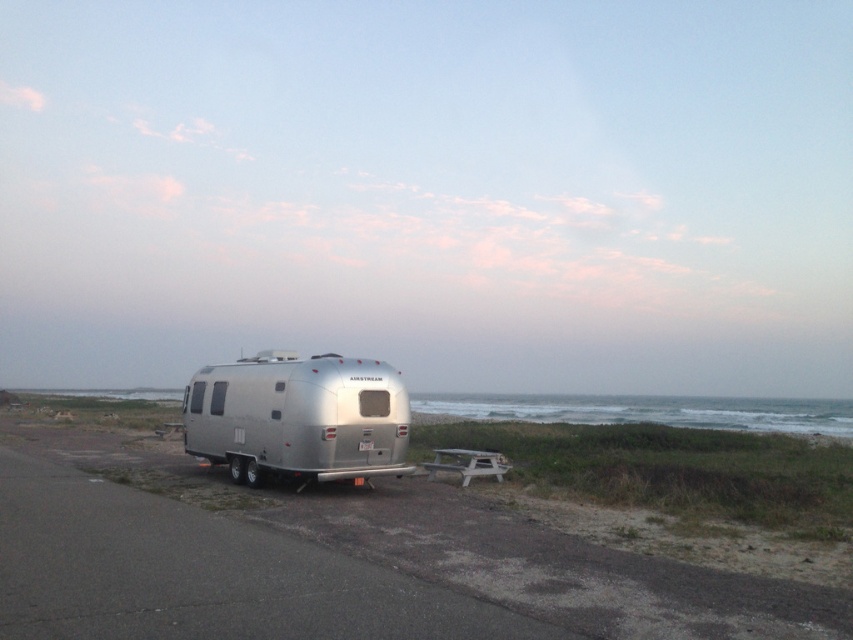
Can you confirm if silver metallic trailer at center is wider than silver metallic airstream trailer at center?

Indeed, silver metallic trailer at center has a greater width compared to silver metallic airstream trailer at center.

Does silver metallic trailer at center appear under silver metallic airstream trailer at center?

Yes.

Where is `silver metallic trailer at center`? silver metallic trailer at center is located at coordinates (332, 561).